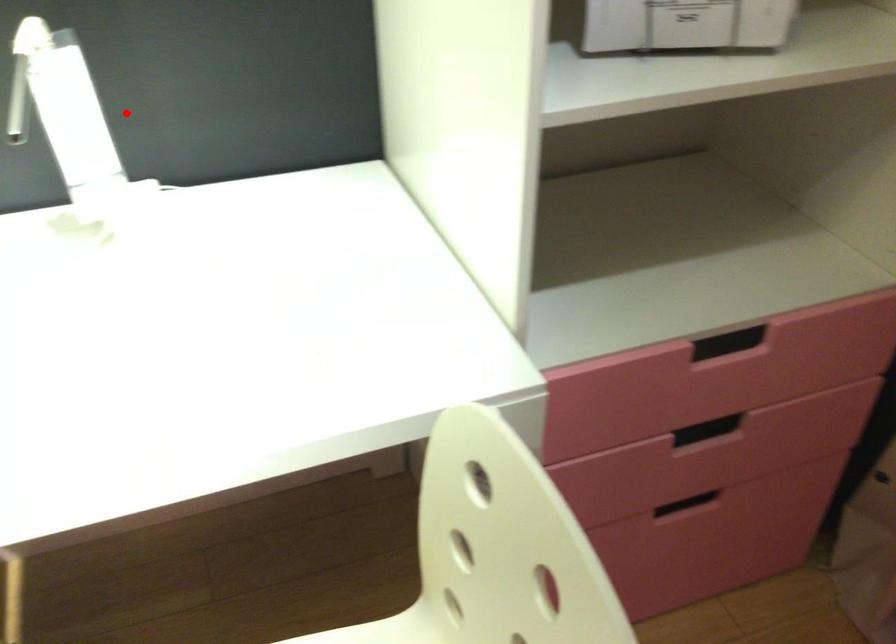
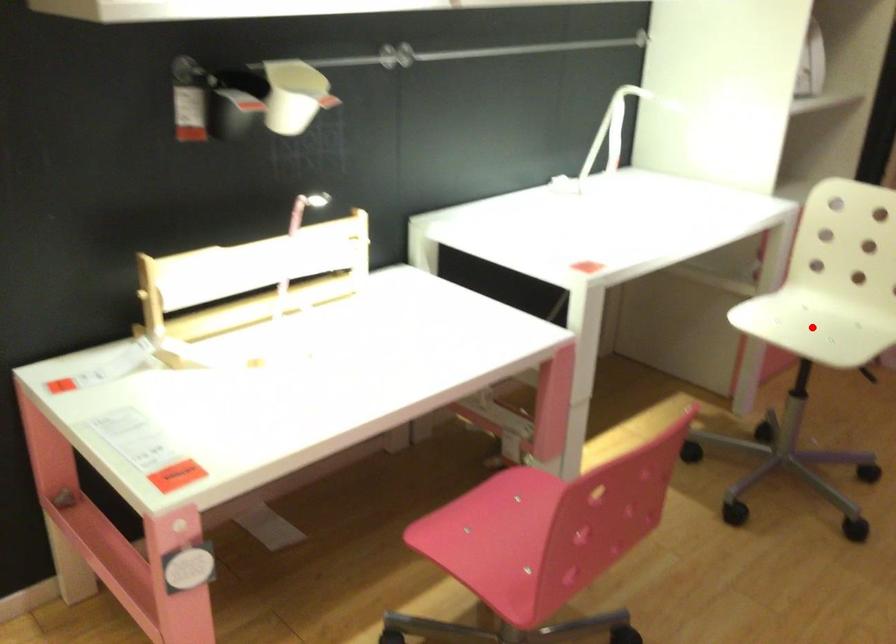
I am providing you with two images of the same scene from different viewpoints. A red point is marked on the first image and another point is marked on the second image. Are the points marked in image1 and image2 representing the same 3D position?

No